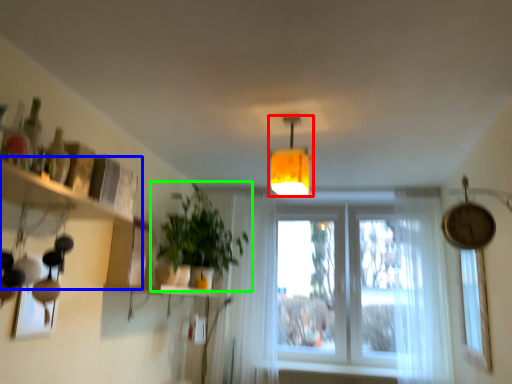
Question: Based on their relative distances, which object is nearer to lamp (highlighted by a red box)? Choose from shelf (highlighted by a blue box) and houseplant (highlighted by a green box).

Choices:
 (A) shelf
 (B) houseplant

Answer: (B)